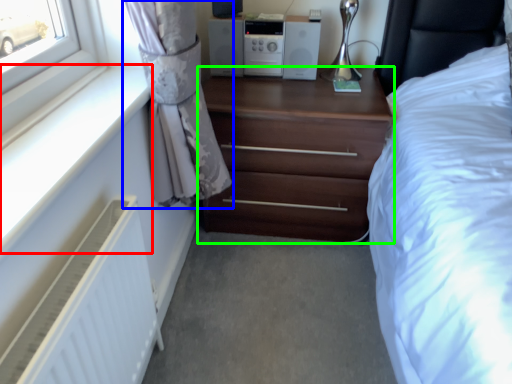
Question: Estimate the real-world distances between objects in this image. Which object is closer to window sill (highlighted by a red box), curtain (highlighted by a blue box) or chest of drawers (highlighted by a green box)?

Choices:
 (A) curtain
 (B) chest of drawers

Answer: (A)